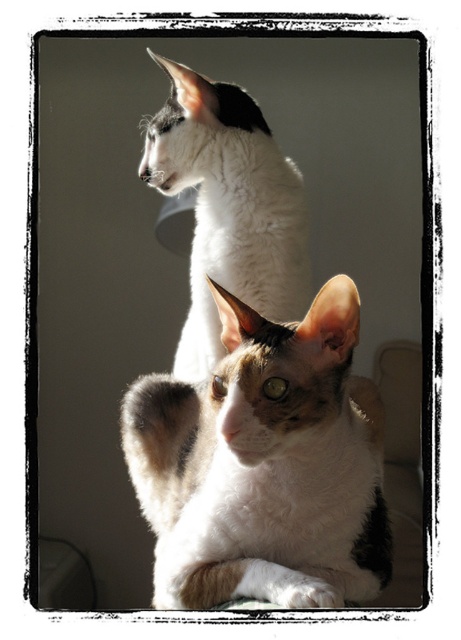
Question: Which point is closer to the camera?

Choices:
 (A) calico fur cat at center
 (B) white fur cat at upper center

Answer: (A)

Question: Which of the following is the closest to the observer?

Choices:
 (A) white fur cat at upper center
 (B) calico fur cat at center

Answer: (B)

Question: Can you confirm if calico fur cat at center is bigger than white fur cat at upper center?

Choices:
 (A) yes
 (B) no

Answer: (A)

Question: Does calico fur cat at center come in front of white fur cat at upper center?

Choices:
 (A) yes
 (B) no

Answer: (A)

Question: Can you confirm if calico fur cat at center is positioned to the left of white fur cat at upper center?

Choices:
 (A) yes
 (B) no

Answer: (B)